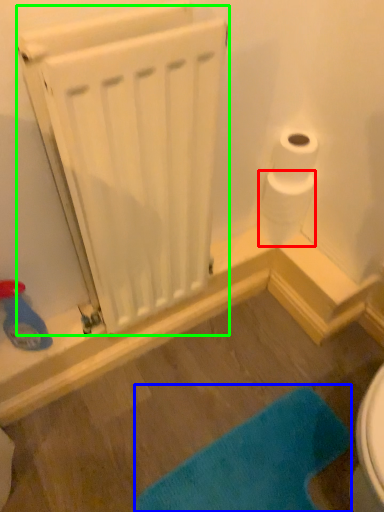
Question: Based on their relative distances, which object is nearer to toilet paper (highlighted by a red box)? Choose from bath mat (highlighted by a blue box) and radiator (highlighted by a green box).

Choices:
 (A) bath mat
 (B) radiator

Answer: (B)